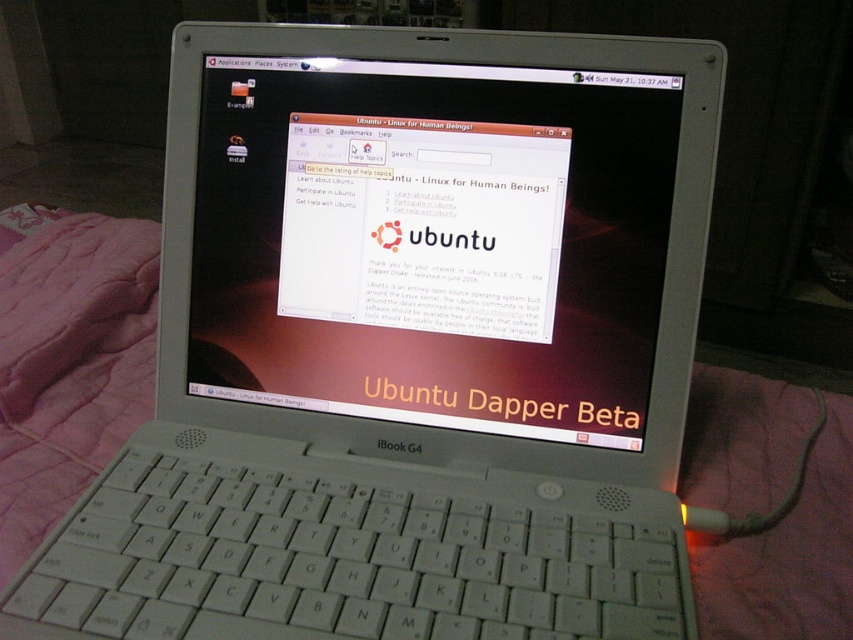
Can you confirm if white glossy laptop screen at center is positioned to the right of pink quilted blanket at left?

Yes, white glossy laptop screen at center is to the right of pink quilted blanket at left.

Is the position of white glossy laptop screen at center more distant than that of pink quilted blanket at left?

Yes.

Is point (326, 77) closer to viewer compared to point (144, 230)?

Yes, it is.

Locate an element on the screen. white glossy laptop screen at center is located at coordinates (433, 243).